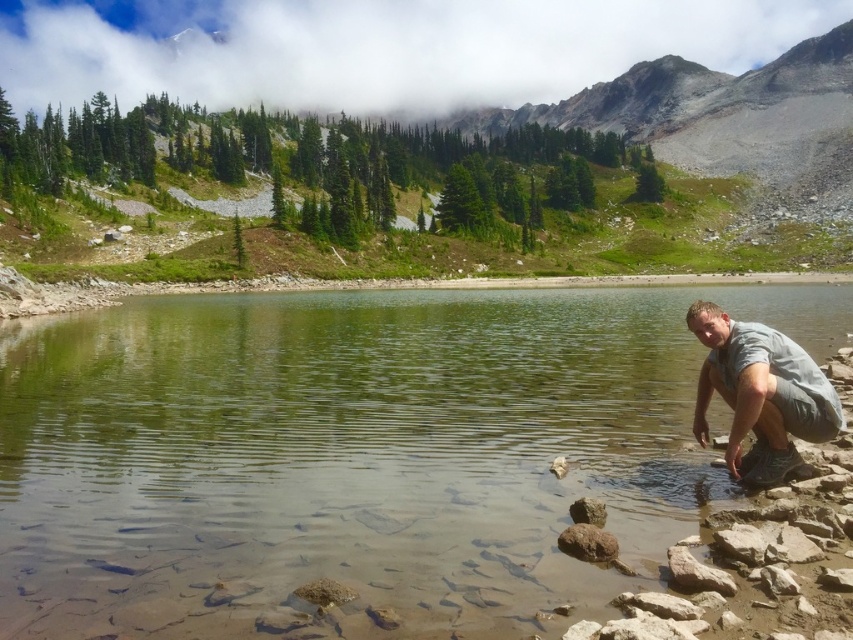
You are a hiker who wants to cross the clear water at lower right without getting your gray fabric pants at lower right wet. Is it possible?

The clear water at lower right is much taller than the gray fabric pants at lower right, so the water is deeper than the height of the pants. Therefore, crossing might get the pants wet up to their height, but since the water is taller, it will likely soak the pants completely.

You are a hiker standing at the edge of the lake and see the clear water at lower right and the gray fabric pants at lower right. Can you reach both items without moving your position? Explain your reasoning.

The clear water at lower right and gray fabric pants at lower right are 18.74 meters apart. Since the distance between them is over 18 meters, you cannot reach both items without moving your position as the distance is too large to cover from a single standing spot.